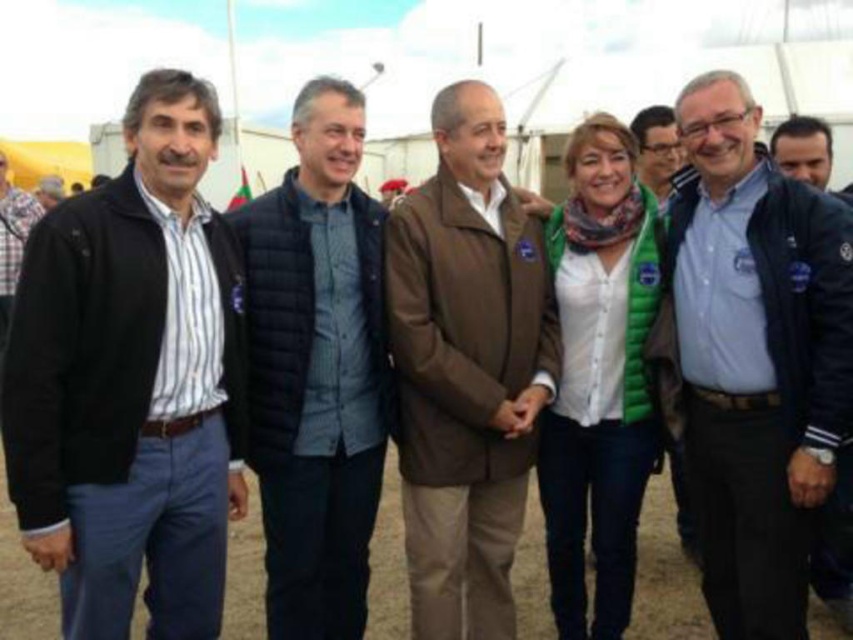
You are a photographer at the event and want to capture both the black quilted vest at center and the matte black jacket at center in a single frame. Since both are at the center, which one will appear taller in the photo?

The black quilted vest at center appears taller in the photo because it has a greater height compared to the matte black jacket at center.

You are organizing a clothing display and need to arrange the blue fabric shirt at center and the matte black jacket at upper center side by side. Based on their widths, which one should be placed on the left to ensure they fit within a 1.5 meter wide display stand?

The blue fabric shirt at center is wider than the matte black jacket at upper center. To fit them side by side on a 1.5 meter wide display stand, place the wider blue fabric shirt at center on the left and the narrower matte black jacket at upper center on the right, ensuring their combined width does not exceed the stand.

You are organizing a photo shoot and need to position two models wearing the black quilted vest at center and the matte black jacket at center. Based on their current positions, which model should you instruct to move to the right to align both outfits in the center of the frame?

The black quilted vest at center is currently to the left of the matte black jacket at center. To align both outfits in the center of the frame, you should instruct the model wearing the black quilted vest at center to move to the right so it aligns with the matte black jacket at center.